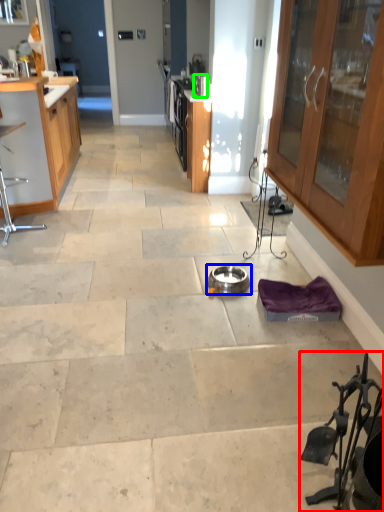
Question: Which object is the closest to the chair (highlighted by a red box)? Choose among these: appliance (highlighted by a blue box) or appliance (highlighted by a green box).

Choices:
 (A) appliance
 (B) appliance

Answer: (A)